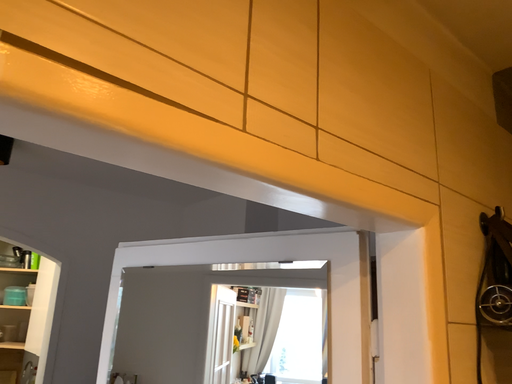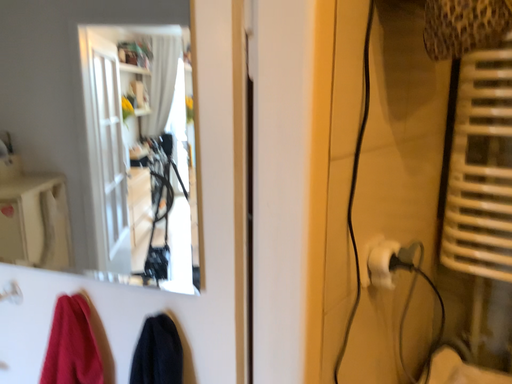
Question: Which way did the camera rotate in the video?

Choices:
 (A) rotated right
 (B) rotated left

Answer: (A)